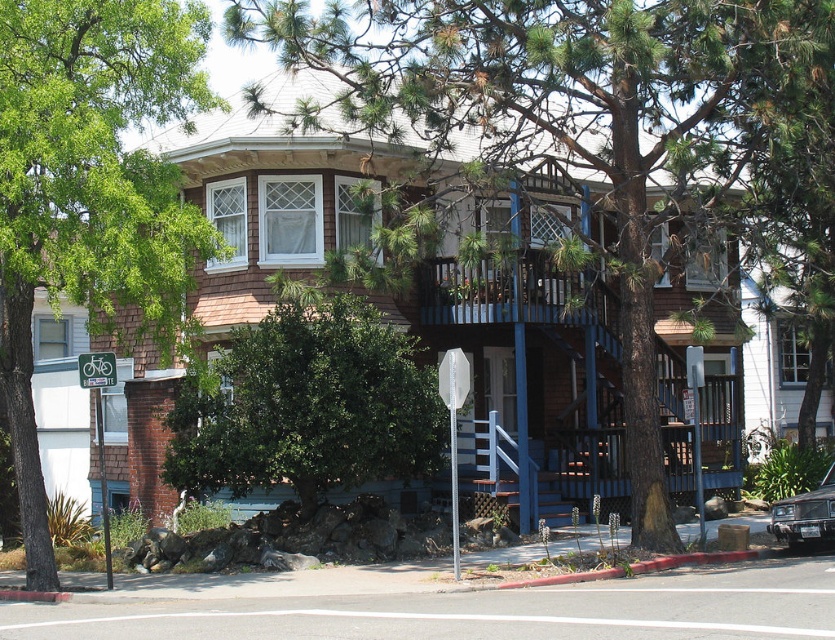
Question: Which of these objects is positioned closest to the green textured tree at center?

Choices:
 (A) metallic bicycle sign at upper left
 (B) green leafy tree at lower center

Answer: (B)

Question: Is green textured tree at center further to camera compared to metallic bicycle sign at upper left?

Choices:
 (A) yes
 (B) no

Answer: (B)

Question: Which point is farther to the camera?

Choices:
 (A) green leafy tree at upper left
 (B) green textured tree at center
 (C) green leafy tree at lower center
 (D) metallic silver car at lower right

Answer: (C)

Question: Does green textured tree at center appear over metallic bicycle sign at upper left?

Choices:
 (A) no
 (B) yes

Answer: (B)

Question: Which of the following is the farthest from the observer?

Choices:
 (A) green leafy tree at lower center
 (B) green textured tree at center
 (C) metallic bicycle sign at upper left

Answer: (A)

Question: Does green leafy tree at upper left appear over metallic silver car at lower right?

Choices:
 (A) yes
 (B) no

Answer: (A)